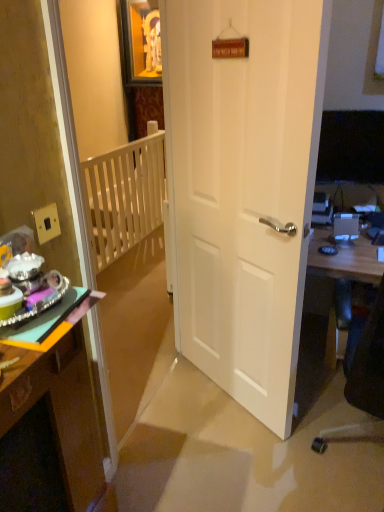
Question: From a real-world perspective, is white wooden balustrade at left located higher than white matte door at center?

Choices:
 (A) yes
 (B) no

Answer: (B)

Question: Does white wooden balustrade at left have a lesser height compared to white matte door at center?

Choices:
 (A) yes
 (B) no

Answer: (A)

Question: Is white wooden balustrade at left to the left of white matte door at center from the viewer's perspective?

Choices:
 (A) no
 (B) yes

Answer: (B)

Question: Does white wooden balustrade at left have a greater height compared to white matte door at center?

Choices:
 (A) no
 (B) yes

Answer: (A)

Question: Is white matte door at center located within white wooden balustrade at left?

Choices:
 (A) no
 (B) yes

Answer: (A)

Question: From the image's perspective, is white wooden balustrade at left under white matte door at center?

Choices:
 (A) yes
 (B) no

Answer: (B)

Question: Is white matte door at center smaller than wooden desk at right?

Choices:
 (A) yes
 (B) no

Answer: (A)

Question: Is white matte door at center to the right of wooden desk at right from the viewer's perspective?

Choices:
 (A) no
 (B) yes

Answer: (A)

Question: Considering the relative sizes of white matte door at center and wooden desk at right in the image provided, is white matte door at center thinner than wooden desk at right?

Choices:
 (A) yes
 (B) no

Answer: (A)

Question: Is white matte door at center behind wooden desk at right?

Choices:
 (A) yes
 (B) no

Answer: (B)

Question: From the image's perspective, would you say white matte door at center is positioned over wooden desk at right?

Choices:
 (A) yes
 (B) no

Answer: (A)

Question: Considering the relative sizes of white matte door at center and wooden desk at right in the image provided, is white matte door at center taller than wooden desk at right?

Choices:
 (A) yes
 (B) no

Answer: (A)

Question: From a real-world perspective, is wooden desk at left positioned over wooden desk at right based on gravity?

Choices:
 (A) yes
 (B) no

Answer: (A)